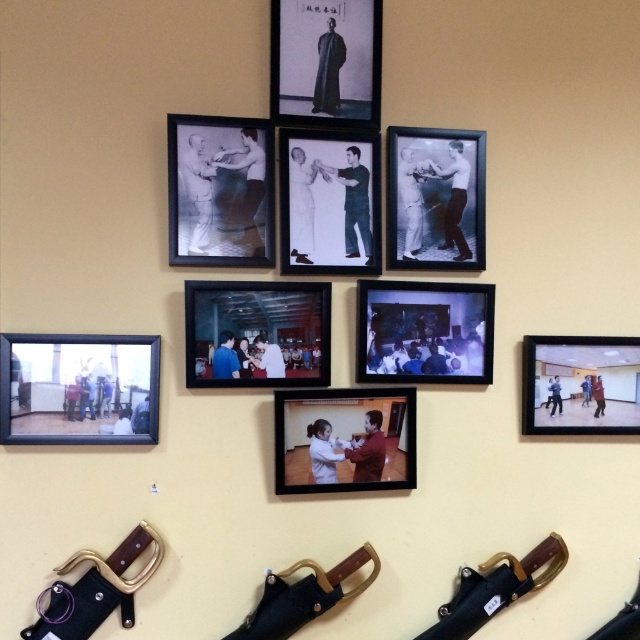
You are hanging a new picture on the wall and need to know the vertical arrangement of the frames. Which frame is positioned lower on the wall between the matte black frame at center and the matte plastic picture frame at center?

The matte black frame at center is located below the matte plastic picture frame at center, so the matte black frame at center is positioned lower on the wall.

You are standing in front of a wall with framed photographs and swords mounted on it. There are two points marked on the wall at coordinates point (44, 362) and point (314, 451). Which of these two points is closer to you?

Point (44, 362) is closer to the viewer than point (314, 451).

You are an interior designer assessing the wall layout. The matte black frame at center and the matte plastic picture frame at center are both central to the design. Which frame has a greater width?

The matte black frame at center has a greater width than the matte plastic picture frame at center according to the description.